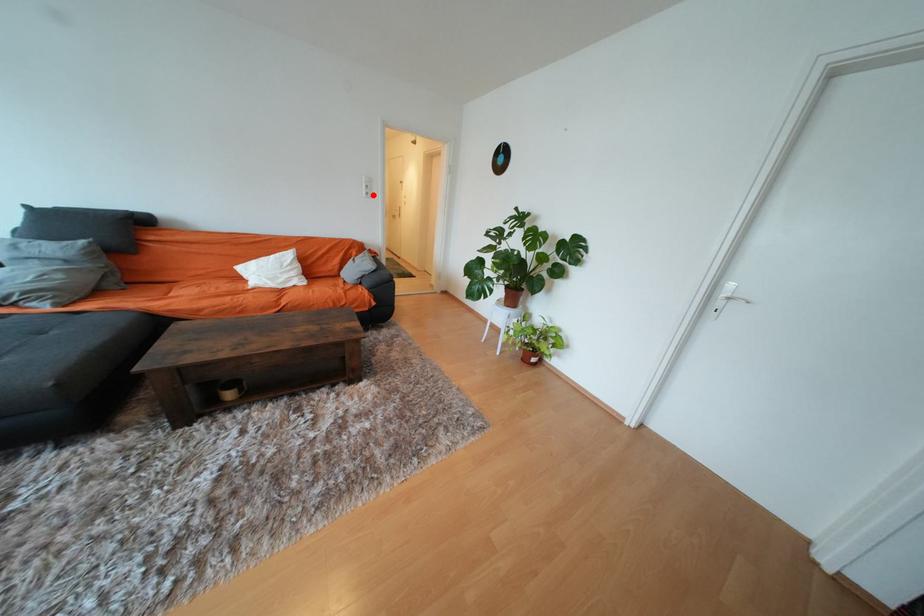
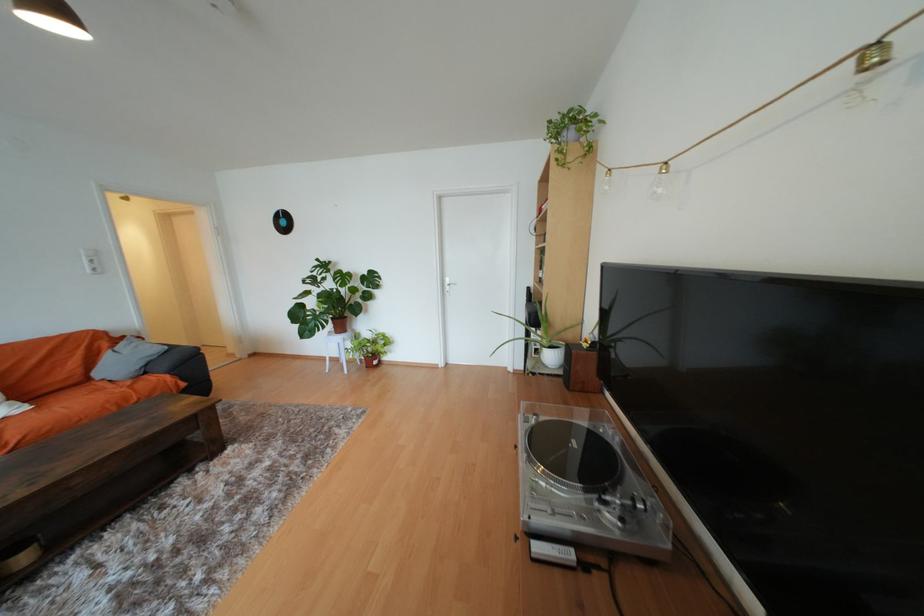
Question: I am providing you with two images of the same scene from different viewpoints. In image1, a red point is highlighted. Considering the same 3D point in image2, which of the following is correct?

Choices:
 (A) It is closer
 (B) It is farther

Answer: (B)